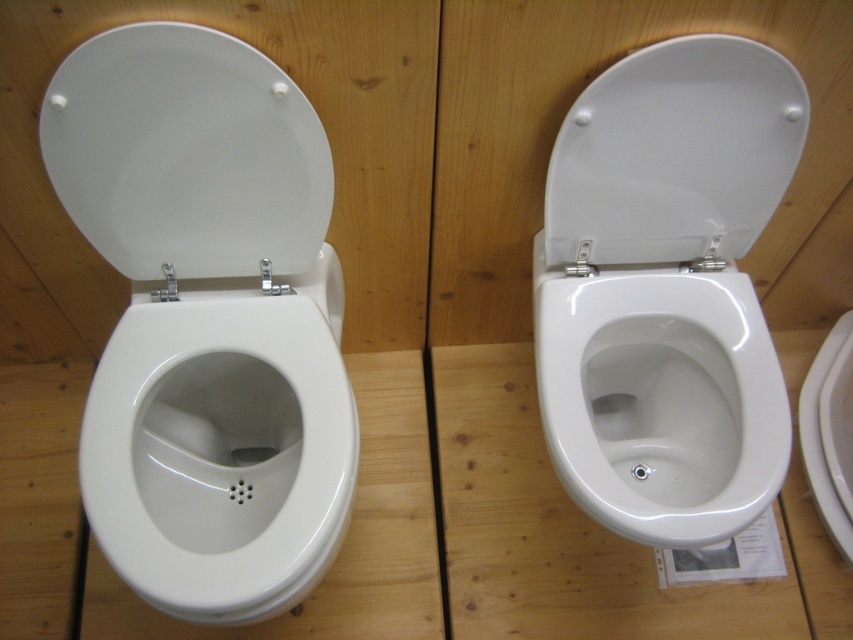
You are a maintenance worker inspecting two toilets in a public restroom. You need to determine which toilet is taller between the white glossy toilet at upper center and the white glossy toilet seat at upper right. Based on the scene, which one is taller?

The white glossy toilet at upper center is much taller than the white glossy toilet seat at upper right.

You are a plumber installing a new toilet. You have two options in front of you. You need to choose the one with the wider base to fit into a larger bathroom space. Which one should you pick between the white glossy toilet bowl at left and the white glossy toilet seat at upper right?

The white glossy toilet bowl at left has a larger width than the white glossy toilet seat at upper right, so you should choose the white glossy toilet bowl at left for the larger bathroom space.

You are a maintenance worker inspecting the two white glossy toilets. You need to check the distance between the white glossy toilet at upper center and the white glossy toilet lid at left. Can you confirm if the distance is less than 20 inches?

The white glossy toilet at upper center is 18.80 inches away from the white glossy toilet lid at left, so yes, the distance is less than 20 inches.